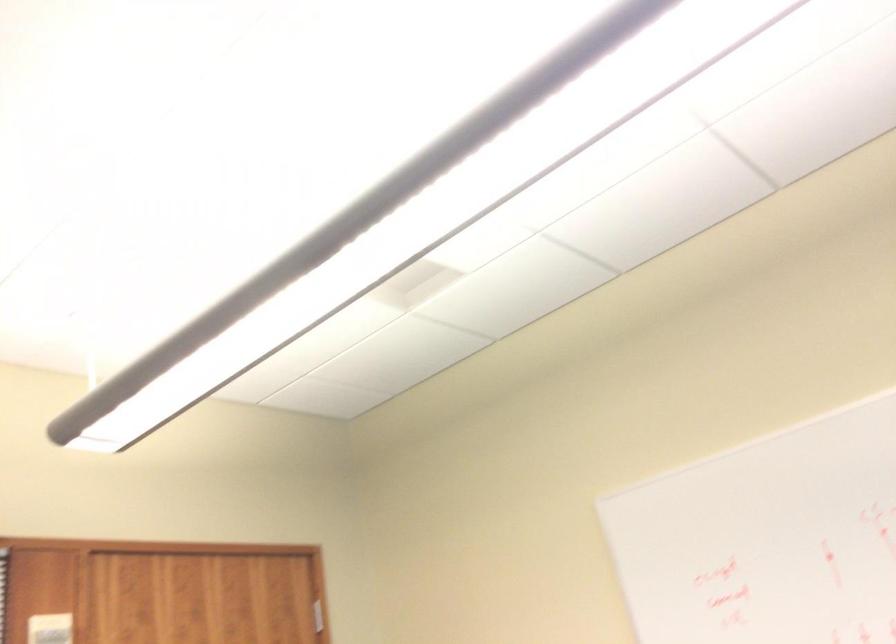
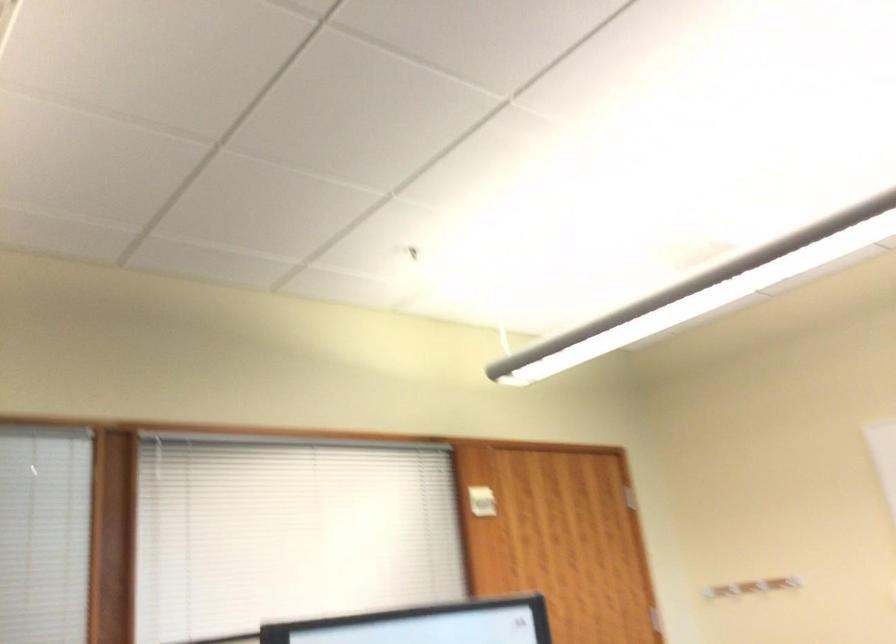
The images are taken continuously from a first-person perspective. In which direction are you moving?

The cameraman walked toward left, backward.